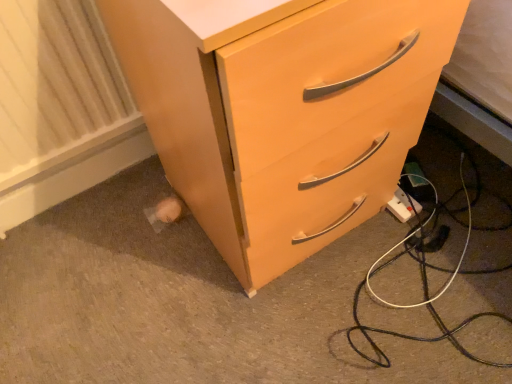
Question: From the image's perspective, is white plastic power strip at lower right on matte wood chest of drawers at center?

Choices:
 (A) yes
 (B) no

Answer: (B)

Question: Is white plastic power strip at lower right bigger than matte wood chest of drawers at center?

Choices:
 (A) no
 (B) yes

Answer: (A)

Question: Considering the relative positions of white plastic power strip at lower right and matte wood chest of drawers at center in the image provided, is white plastic power strip at lower right to the left of matte wood chest of drawers at center from the viewer's perspective?

Choices:
 (A) yes
 (B) no

Answer: (B)

Question: Is the depth of white plastic power strip at lower right less than that of matte wood chest of drawers at center?

Choices:
 (A) no
 (B) yes

Answer: (A)

Question: From a real-world perspective, is white plastic power strip at lower right below matte wood chest of drawers at center?

Choices:
 (A) no
 (B) yes

Answer: (B)

Question: Is white plastic power strip at lower right wider or thinner than matte wood chest of drawers at center?

Choices:
 (A) thin
 (B) wide

Answer: (A)

Question: Is white plastic power strip at lower right inside or outside of matte wood chest of drawers at center?

Choices:
 (A) outside
 (B) inside

Answer: (A)

Question: From their relative heights in the image, would you say white plastic power strip at lower right is taller or shorter than matte wood chest of drawers at center?

Choices:
 (A) tall
 (B) short

Answer: (B)

Question: Is white plastic power strip at lower right bigger or smaller than matte wood chest of drawers at center?

Choices:
 (A) small
 (B) big

Answer: (A)

Question: Based on their sizes in the image, would you say white textured radiator at lower left is bigger or smaller than matte wood chest of drawers at center?

Choices:
 (A) small
 (B) big

Answer: (A)

Question: Which is correct: white textured radiator at lower left is inside matte wood chest of drawers at center, or outside of it?

Choices:
 (A) outside
 (B) inside

Answer: (A)

Question: From the image's perspective, is white textured radiator at lower left positioned above or below matte wood chest of drawers at center?

Choices:
 (A) below
 (B) above

Answer: (A)

Question: Would you say white textured radiator at lower left is to the left or to the right of matte wood chest of drawers at center in the picture?

Choices:
 (A) left
 (B) right

Answer: (A)

Question: In terms of height, does matte wood chest of drawers at center look taller or shorter compared to white textured radiator at lower left?

Choices:
 (A) tall
 (B) short

Answer: (A)

Question: Does point (305, 29) appear closer or farther from the camera than point (31, 36)?

Choices:
 (A) closer
 (B) farther

Answer: (A)